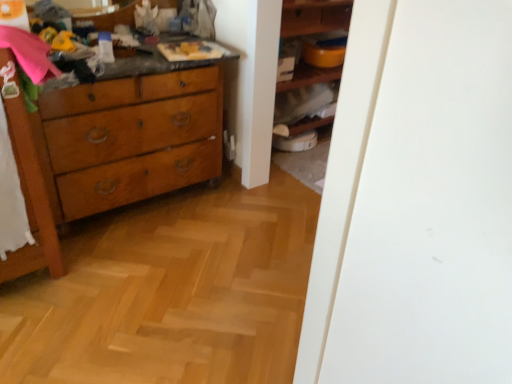
What do you see at coordinates (109, 147) in the screenshot? I see `wooden dresser at left` at bounding box center [109, 147].

What is the approximate height of wooden shelves at center?

It is 35.15 inches.

Find the location of a particular element. wooden dresser at left is located at coordinates (109, 147).

Can you confirm if wooden cabinet at center is thinner than wooden dresser at left?

Yes.

Is wooden cabinet at center not near wooden dresser at left?

wooden cabinet at center is actually quite close to wooden dresser at left.

Measure the distance between wooden cabinet at center and wooden dresser at left.

wooden cabinet at center is 97.80 centimeters away from wooden dresser at left.

Considering their positions, is wooden cabinet at center located in front of or behind wooden dresser at left?

wooden cabinet at center is positioned farther from the viewer than wooden dresser at left.

In the scene shown: Between wooden cabinet at center and wooden shelves at center, which one has less height?

With less height is wooden cabinet at center.

Choose the correct answer: Is wooden cabinet at center inside wooden shelves at center or outside it?

wooden cabinet at center is spatially positioned inside wooden shelves at center.

Considering the relative sizes of wooden cabinet at center and wooden shelves at center in the image provided, is wooden cabinet at center thinner than wooden shelves at center?

Correct, the width of wooden cabinet at center is less than that of wooden shelves at center.

You are a GUI agent. You are given a task and a screenshot of the screen. Output one action in this format:
    pyautogui.click(x=<x>, y=<y>)
    Task: Click on the shelf located above the wooden cabinet at center (from the image's perspective)
    
    Given the screenshot: What is the action you would take?
    pyautogui.click(x=314, y=16)

Can you confirm if wooden shelves at center is thinner than wooden cabinet at center?

Incorrect, the width of wooden shelves at center is not less than that of wooden cabinet at center.

Can you tell me how much wooden shelves at center and wooden cabinet at center differ in facing direction?

The facing directions of wooden shelves at center and wooden cabinet at center are 2.09 degrees apart.

From a real-world perspective, is wooden shelves at center above or below wooden cabinet at center?

Clearly, from a real-world perspective, wooden shelves at center is above wooden cabinet at center.

Considering the sizes of objects wooden dresser at left and wooden cabinet at center in the image provided, who is thinner, wooden dresser at left or wooden cabinet at center?

Thinner between the two is wooden cabinet at center.

Is wooden dresser at left outside of wooden cabinet at center?

Yes, wooden dresser at left is not within wooden cabinet at center.

Is wooden dresser at left facing away from wooden cabinet at center?

No, wooden dresser at left is not facing the opposite direction of wooden cabinet at center.

Considering the relative positions of wooden dresser at left and wooden cabinet at center in the image provided, is wooden dresser at left to the left of wooden cabinet at center from the viewer's perspective?

Indeed, wooden dresser at left is positioned on the left side of wooden cabinet at center.

In the scene shown: Considering the sizes of wooden dresser at left and wooden shelves at center in the image, is wooden dresser at left taller or shorter than wooden shelves at center?

In the image, wooden dresser at left appears to be taller than wooden shelves at center.

This screenshot has width=512, height=384. In the image, there is a wooden shelves at center. Identify the location of the chest of drawers below it (from the image's perspective). (109, 147).

From a real-world perspective, is wooden dresser at left beneath wooden shelves at center?

Actually, wooden dresser at left is physically above wooden shelves at center in the real world.

From the image's perspective, which is below, wooden dresser at left or wooden shelves at center?

wooden dresser at left appears lower in the image.

Relative to wooden dresser at left, is wooden shelves at center in front or behind?

wooden shelves at center is behind wooden dresser at left.

Is wooden shelves at center at the left side of wooden dresser at left?

No, wooden shelves at center is not to the left of wooden dresser at left.

Is wooden dresser at left a part of wooden shelves at center?

No, wooden dresser at left is not a part of wooden shelves at center.

Between wooden shelves at center and wooden dresser at left, which one has smaller size?

wooden shelves at center is smaller.

This screenshot has height=384, width=512. Find the location of `chest of drawers above the wooden cabinet at center (from a real-world perspective)`. chest of drawers above the wooden cabinet at center (from a real-world perspective) is located at coordinates (109, 147).

Where is `cabinet on the left of wooden shelves at center`? This screenshot has width=512, height=384. cabinet on the left of wooden shelves at center is located at coordinates (303, 106).

Looking at the image, which one is located further to wooden cabinet at center, wooden dresser at left or wooden shelves at center?

wooden dresser at left is positioned further to the anchor wooden cabinet at center.

From the image, which object appears to be farther from wooden cabinet at center, wooden shelves at center or wooden dresser at left?

wooden dresser at left is further to wooden cabinet at center.

Looking at the image, which one is located closer to wooden shelves at center, wooden cabinet at center or wooden dresser at left?

wooden cabinet at center lies closer to wooden shelves at center than the other object.

From the image, which object appears to be farther from wooden shelves at center, wooden dresser at left or wooden cabinet at center?

wooden dresser at left lies further to wooden shelves at center than the other object.

Looking at the image, which one is located closer to wooden dresser at left, wooden cabinet at center or wooden shelves at center?

Among the two, wooden cabinet at center is located nearer to wooden dresser at left.

From the image, which object appears to be nearer to wooden dresser at left, wooden shelves at center or wooden cabinet at center?

wooden cabinet at center.

Locate an element on the screen. shelf located between wooden dresser at left and wooden cabinet at center in the depth direction is located at coordinates (314, 16).